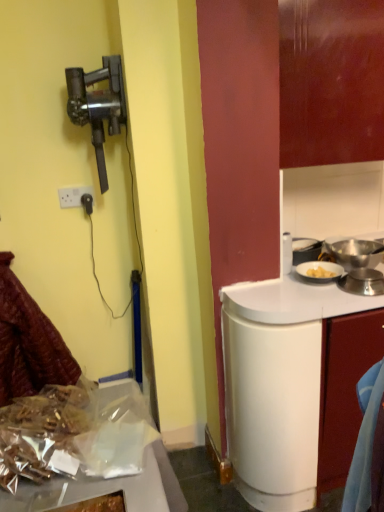
Question: Can we say shiny metallic foil at lower left lies outside metallic black vacuum cleaner at left?

Choices:
 (A) yes
 (B) no

Answer: (A)

Question: Is shiny metallic foil at lower left smaller than metallic black vacuum cleaner at left?

Choices:
 (A) no
 (B) yes

Answer: (A)

Question: Are shiny metallic foil at lower left and metallic black vacuum cleaner at left located far from each other?

Choices:
 (A) no
 (B) yes

Answer: (B)

Question: Does shiny metallic foil at lower left have a lesser width compared to metallic black vacuum cleaner at left?

Choices:
 (A) yes
 (B) no

Answer: (B)

Question: From a real-world perspective, is shiny metallic foil at lower left positioned under metallic black vacuum cleaner at left based on gravity?

Choices:
 (A) yes
 (B) no

Answer: (A)

Question: In terms of width, does metallic black vacuum cleaner at left look wider or thinner when compared to white glossy cabinet at right?

Choices:
 (A) wide
 (B) thin

Answer: (A)

Question: Is metallic black vacuum cleaner at left inside or outside of white glossy cabinet at right?

Choices:
 (A) inside
 (B) outside

Answer: (B)

Question: From a real-world perspective, is metallic black vacuum cleaner at left above or below white glossy cabinet at right?

Choices:
 (A) above
 (B) below

Answer: (A)

Question: From the image's perspective, is metallic black vacuum cleaner at left positioned above or below white glossy cabinet at right?

Choices:
 (A) above
 (B) below

Answer: (A)

Question: In terms of height, does shiny metallic foil at lower left look taller or shorter compared to leather-like maroon coat at lower left?

Choices:
 (A) short
 (B) tall

Answer: (A)

Question: From the image's perspective, is shiny metallic foil at lower left above or below leather-like maroon coat at lower left?

Choices:
 (A) above
 (B) below

Answer: (B)

Question: Visually, is shiny metallic foil at lower left positioned to the left or to the right of leather-like maroon coat at lower left?

Choices:
 (A) right
 (B) left

Answer: (A)

Question: Is shiny metallic foil at lower left inside or outside of leather-like maroon coat at lower left?

Choices:
 (A) inside
 (B) outside

Answer: (B)

Question: Considering the positions of white glossy cabinet at right and white plastic power outlet at upper left in the image, is white glossy cabinet at right wider or thinner than white plastic power outlet at upper left?

Choices:
 (A) thin
 (B) wide

Answer: (B)

Question: From their relative heights in the image, would you say white glossy cabinet at right is taller or shorter than white plastic power outlet at upper left?

Choices:
 (A) tall
 (B) short

Answer: (A)